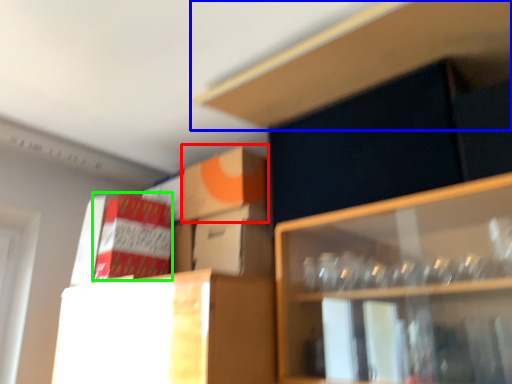
Question: Estimate the real-world distances between objects in this image. Which object is closer to cardboard box (highlighted by a red box), cabinet (highlighted by a blue box) or cardboard box (highlighted by a green box)?

Choices:
 (A) cabinet
 (B) cardboard box

Answer: (B)